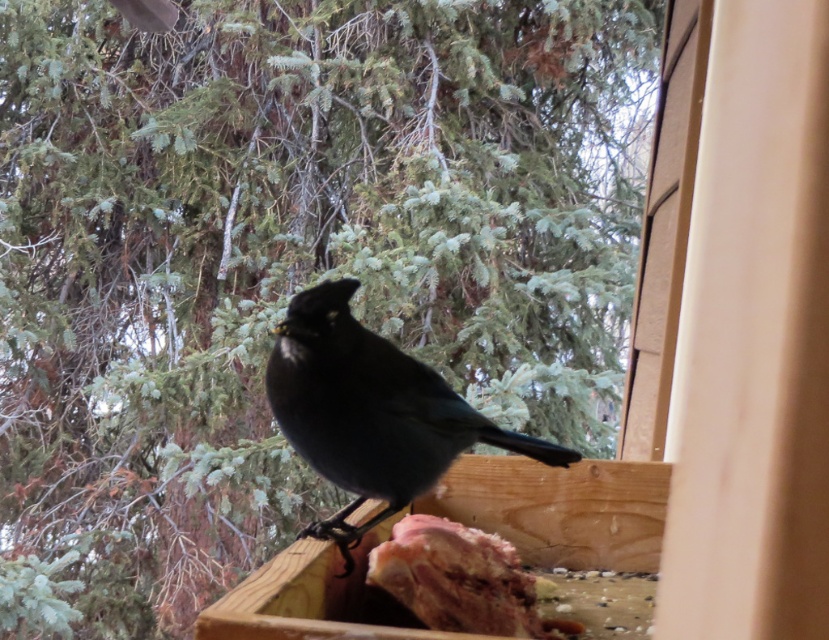
Question: Among these objects, which one is farthest from the camera?

Choices:
 (A) raw meat at center
 (B) shiny black bird at center

Answer: (A)

Question: Which object is closer to the camera taking this photo?

Choices:
 (A) raw meat at center
 (B) shiny black bird at center

Answer: (B)

Question: Among these objects, which one is farthest from the camera?

Choices:
 (A) shiny black bird at center
 (B) raw meat at center

Answer: (B)

Question: Can you confirm if shiny black bird at center is thinner than raw meat at center?

Choices:
 (A) no
 (B) yes

Answer: (A)

Question: Can you confirm if shiny black bird at center is positioned above raw meat at center?

Choices:
 (A) no
 (B) yes

Answer: (B)

Question: Can you confirm if shiny black bird at center is positioned below raw meat at center?

Choices:
 (A) no
 (B) yes

Answer: (A)